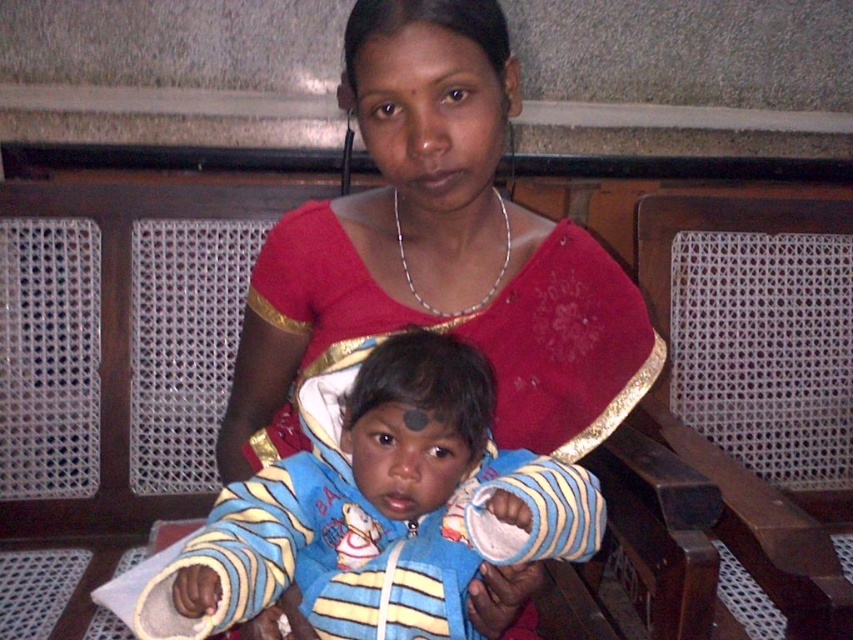
Between matte red blouse at center and blue striped fabric at center, which one appears on the left side from the viewer's perspective?

blue striped fabric at center

Describe the element at coordinates (438, 252) in the screenshot. I see `matte red blouse at center` at that location.

What do you see at coordinates (438, 252) in the screenshot? I see `matte red blouse at center` at bounding box center [438, 252].

Locate an element on the screen. The image size is (853, 640). matte red blouse at center is located at coordinates (438, 252).